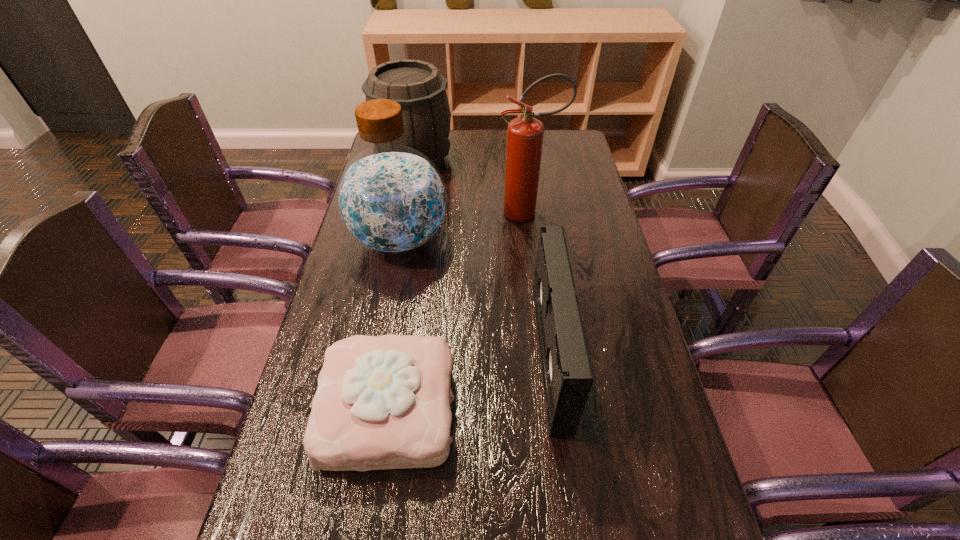
Identify the location of fire extinguisher. Image resolution: width=960 pixels, height=540 pixels. (525, 134).

You are a GUI agent. You are given a task and a screenshot of the screen. Output one action in this format:
    pyautogui.click(x=<x>, y=<y>)
    Task: Click on the water jug
    
    Given the screenshot: What is the action you would take?
    pyautogui.click(x=391, y=199)

This screenshot has width=960, height=540. I want to click on the farthest object, so click(x=419, y=88).

Find the location of a particular element. The image size is (960, 540). the third tallest object is located at coordinates (419, 88).

This screenshot has height=540, width=960. I want to click on the fourth tallest object, so click(x=567, y=375).

The width and height of the screenshot is (960, 540). What are the coordinates of `cake` in the screenshot? It's located at (383, 402).

This screenshot has height=540, width=960. I want to click on vacant area situated from the nozzle of the fire extinguisher, so click(x=403, y=213).

The width and height of the screenshot is (960, 540). I want to click on vacant space situated 0.400m from the nozzle of the fire extinguisher, so click(x=376, y=213).

At what (x,y) coordinates should I click in order to perform the action: click on free space located 0.270m from the nozzle of the fire extinguisher. Please return your answer as a coordinate pair (x, y). The width and height of the screenshot is (960, 540). Looking at the image, I should click on (416, 213).

Where is `vacant space located on the front of the water jug`? The width and height of the screenshot is (960, 540). vacant space located on the front of the water jug is located at coordinates (381, 338).